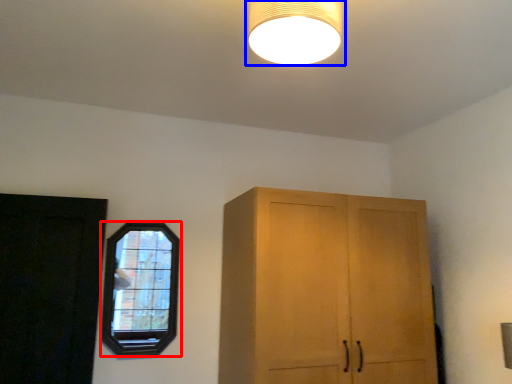
Question: Which point is closer to the camera, window (highlighted by a red box) or lamp (highlighted by a blue box)?

Choices:
 (A) window
 (B) lamp

Answer: (B)